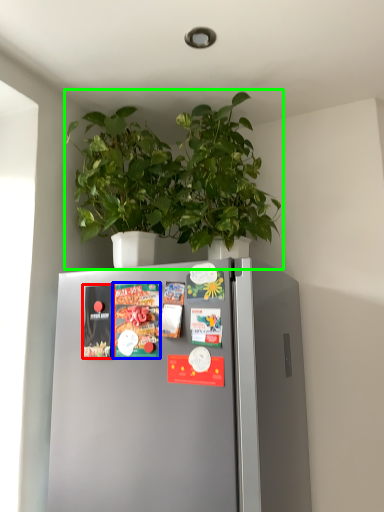
Question: Which object is the closest to the magazine (highlighted by a red box)? Choose among these: magazine (highlighted by a blue box) or houseplant (highlighted by a green box).

Choices:
 (A) magazine
 (B) houseplant

Answer: (A)